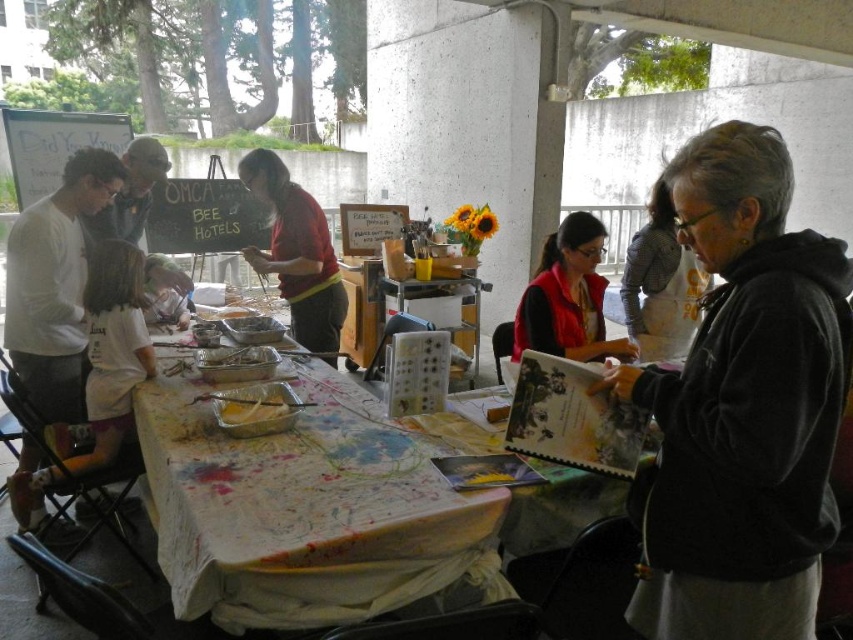
How distant is white paper table at center from red fabric shirt at center?

white paper table at center is 3.40 feet away from red fabric shirt at center.

Can you confirm if white paper table at center is positioned to the left of red fabric shirt at center?

No, white paper table at center is not to the left of red fabric shirt at center.

The height and width of the screenshot is (640, 853). What are the coordinates of `white paper table at center` in the screenshot? It's located at (306, 512).

Is white paper table at center bigger than matte black hoodie at right?

Yes, white paper table at center is bigger than matte black hoodie at right.

Does white paper table at center have a lesser width compared to matte black hoodie at right?

Incorrect, white paper table at center's width is not less than matte black hoodie at right's.

This screenshot has height=640, width=853. Identify the location of white paper table at center. (306, 512).

Does point (318, 544) come closer to viewer compared to point (113, 419)?

Yes, point (318, 544) is in front of point (113, 419).

Describe the element at coordinates (306, 512) in the screenshot. This screenshot has width=853, height=640. I see `white paper table at center` at that location.

Where is `white paper table at center`? white paper table at center is located at coordinates (306, 512).